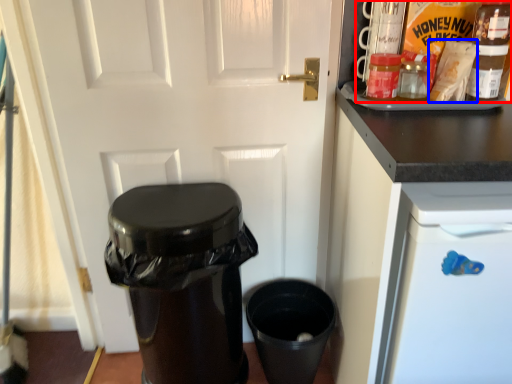
Question: Among these objects, which one is farthest to the camera, food (highlighted by a red box) or food (highlighted by a blue box)?

Choices:
 (A) food
 (B) food

Answer: (A)